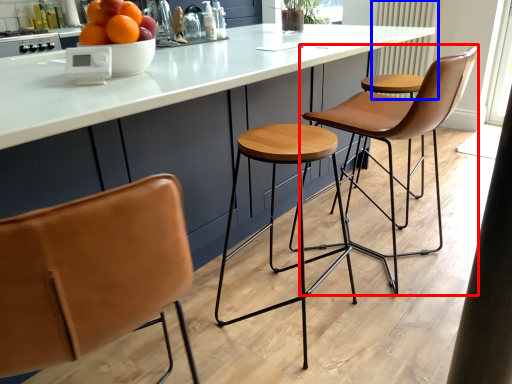
Question: Which of the following is the closest to the observer, chair (highlighted by a red box) or radiator (highlighted by a blue box)?

Choices:
 (A) chair
 (B) radiator

Answer: (A)